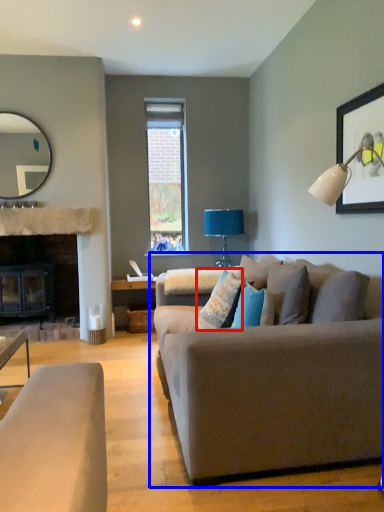
Question: Among these objects, which one is farthest to the camera, pillow (highlighted by a red box) or studio couch (highlighted by a blue box)?

Choices:
 (A) pillow
 (B) studio couch

Answer: (A)